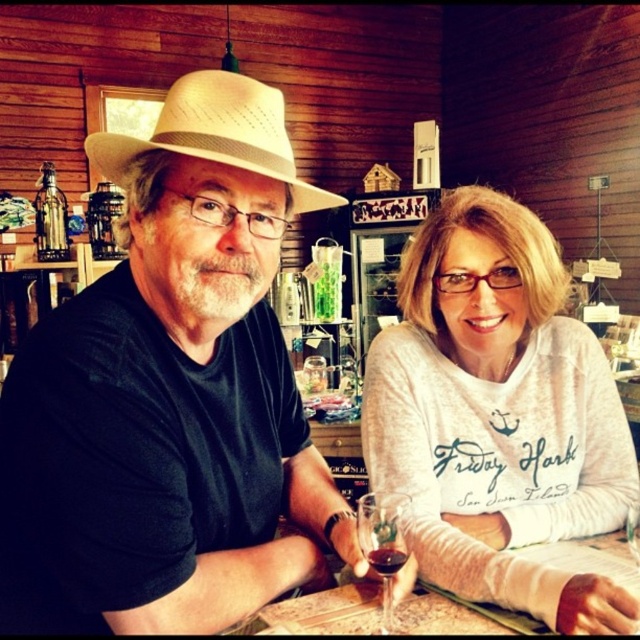
Does white soft sweater at center appear over translucent glass at lower center?

Indeed, white soft sweater at center is positioned over translucent glass at lower center.

Between white soft sweater at center and translucent glass at lower center, which one has less height?

translucent glass at lower center

This screenshot has height=640, width=640. I want to click on white soft sweater at center, so click(499, 416).

Does matte straw hat at center have a lesser height compared to beige straw cowboy hat at upper center?

Incorrect, matte straw hat at center's height does not fall short of beige straw cowboy hat at upper center's.

Describe the element at coordinates (170, 396) in the screenshot. I see `matte straw hat at center` at that location.

You are a GUI agent. You are given a task and a screenshot of the screen. Output one action in this format:
    pyautogui.click(x=<x>, y=<y>)
    Task: Click on the matte straw hat at center
    
    Given the screenshot: What is the action you would take?
    pyautogui.click(x=170, y=396)

Where is `white soft sweater at center`? The width and height of the screenshot is (640, 640). white soft sweater at center is located at coordinates (499, 416).

Between white soft sweater at center and beige straw cowboy hat at upper center, which one has more height?

white soft sweater at center

Where is `white soft sweater at center`? This screenshot has width=640, height=640. white soft sweater at center is located at coordinates (499, 416).

I want to click on white soft sweater at center, so (499, 416).